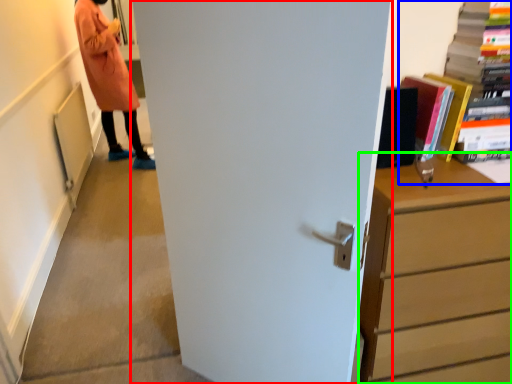
Question: Considering the real-world distances, which object is closest to door (highlighted by a red box)? book (highlighted by a blue box) or chest of drawers (highlighted by a green box).

Choices:
 (A) book
 (B) chest of drawers

Answer: (B)